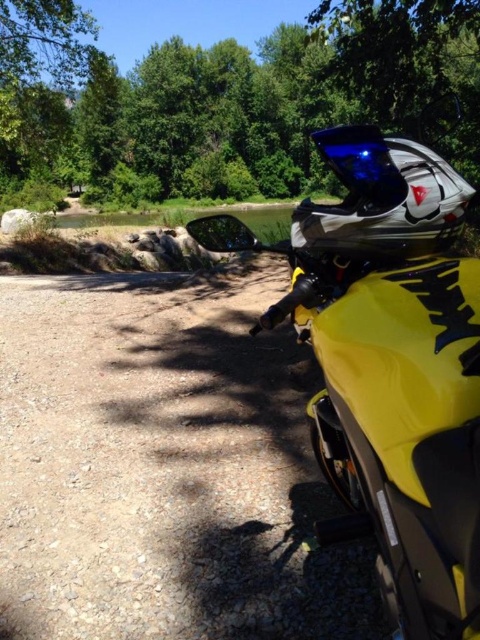
Can you confirm if yellow matte dirt track at center is positioned above green leafy tree at upper center?

No, yellow matte dirt track at center is not above green leafy tree at upper center.

Find the location of a particular element. yellow matte dirt track at center is located at coordinates (164, 467).